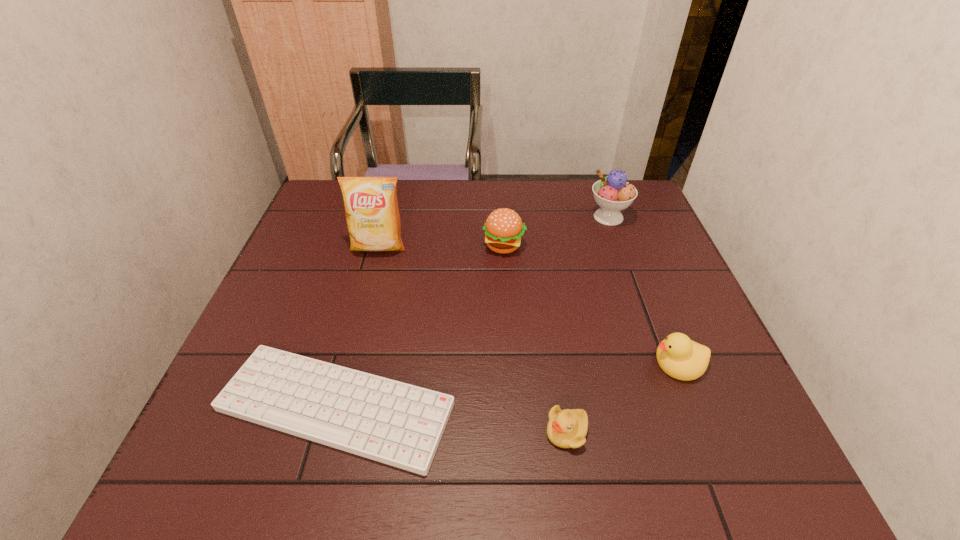
The height and width of the screenshot is (540, 960). In order to click on vacant space at the right edge in this screenshot , I will do `click(656, 233)`.

The image size is (960, 540). I want to click on vacant area at the far left corner, so click(x=333, y=187).

The width and height of the screenshot is (960, 540). In order to click on free location at the far right corner of the desktop in this screenshot , I will do `click(645, 214)`.

The image size is (960, 540). In order to click on vacant space that is in between the crisp (potato chip) and the right duckling in this screenshot , I will do `click(528, 305)`.

The height and width of the screenshot is (540, 960). Identify the location of vacant space in between the fourth shortest object and the computer keyboard. (420, 326).

You are a GUI agent. You are given a task and a screenshot of the screen. Output one action in this format:
    pyautogui.click(x=<x>, y=<y>)
    Task: Click on the empty space that is in between the fourth shortest object and the computer keyboard
    The image size is (960, 540).
    Given the screenshot: What is the action you would take?
    pyautogui.click(x=420, y=326)

This screenshot has height=540, width=960. I want to click on free point between the fourth shortest object and the farthest object, so click(556, 231).

I want to click on vacant area that lies between the crisp (potato chip) and the computer keyboard, so click(x=357, y=327).

Locate an element on the screen. The width and height of the screenshot is (960, 540). free spot between the computer keyboard and the taller duckling is located at coordinates (507, 384).

Image resolution: width=960 pixels, height=540 pixels. Identify the location of vacant point located between the hamburger and the nearer duckling. (536, 339).